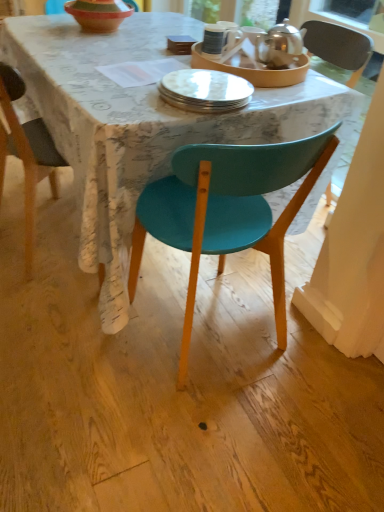
You are a GUI agent. You are given a task and a screenshot of the screen. Output one action in this format:
    pyautogui.click(x=<x>, y=<y>)
    Task: Click on the free space on the front side of teal plastic chair at center
    Image resolution: width=384 pixels, height=512 pixels.
    Given the screenshot: What is the action you would take?
    pyautogui.click(x=206, y=435)